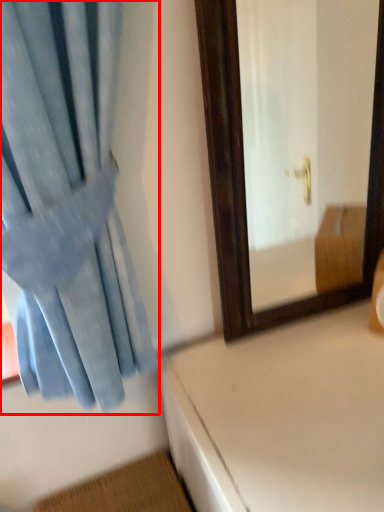
Question: From the image's perspective, what is the correct spatial positioning of curtain (annotated by the red box) in reference to table?

Choices:
 (A) above
 (B) below

Answer: (A)